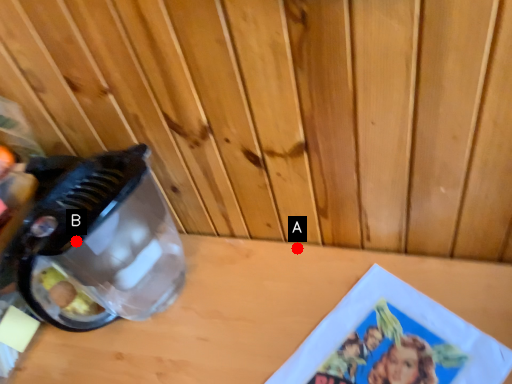
Question: Two points are circled on the image, labeled by A and B beside each circle. Which point is closer to the camera taking this photo?

Choices:
 (A) A is closer
 (B) B is closer

Answer: (B)